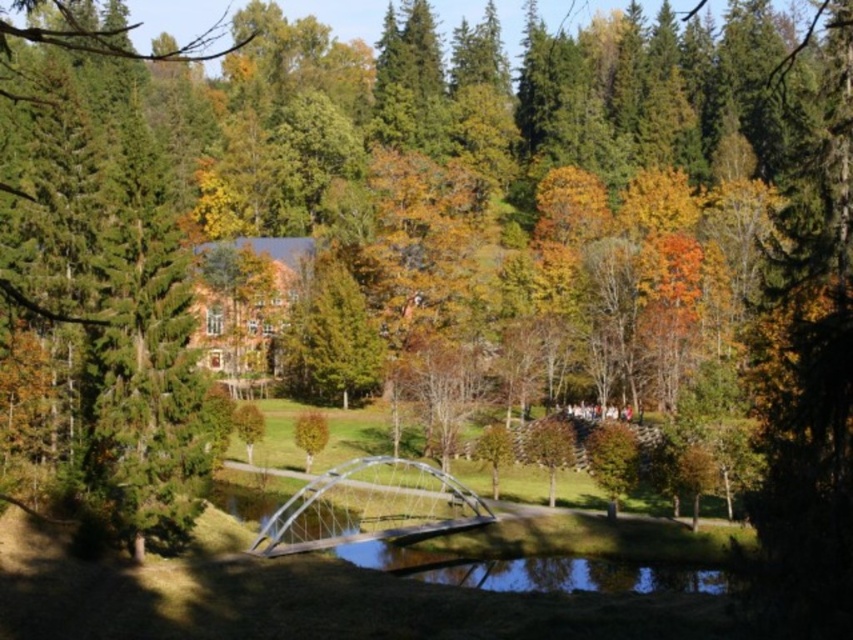
You are planning to install a new lighting system on the clear glass bridge at center and the green coniferous tree at left. Which object requires taller lighting poles to accommodate its height?

The green coniferous tree at left requires taller lighting poles because it is much taller than the clear glass bridge at center.

You are a landscape architect planning to install a new bench in the park. The bench requires a minimum of 50 meters distance from the clear glass bridge at center for safety regulations. Based on the scene, is the proposed bench placement compliant with the safety requirements?

The clear glass bridge at center is 56.57 meters away from the camera. Since the bench requires a minimum of 50 meters distance, the proposed bench placement is compliant with the safety requirements as it exceeds the required distance.